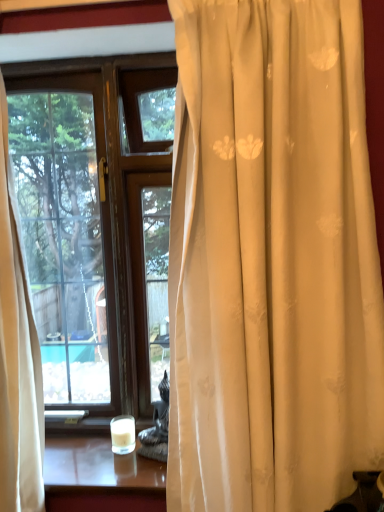
Question: Considering the relative positions of black textured statue at lower center and white glass candle at lower center in the image provided, is black textured statue at lower center to the left or to the right of white glass candle at lower center?

Choices:
 (A) left
 (B) right

Answer: (B)

Question: Considering the positions of black textured statue at lower center and white glass candle at lower center in the image, is black textured statue at lower center wider or thinner than white glass candle at lower center?

Choices:
 (A) thin
 (B) wide

Answer: (B)

Question: Is point (162, 443) closer or farther from the camera than point (127, 445)?

Choices:
 (A) closer
 (B) farther

Answer: (B)

Question: Looking at the image, does white glass candle at lower center seem bigger or smaller compared to black textured statue at lower center?

Choices:
 (A) big
 (B) small

Answer: (B)

Question: Does point (114, 452) appear closer or farther from the camera than point (163, 430)?

Choices:
 (A) closer
 (B) farther

Answer: (A)

Question: Is white glass candle at lower center in front of or behind black textured statue at lower center in the image?

Choices:
 (A) behind
 (B) front

Answer: (A)

Question: From the image's perspective, is white glass candle at lower center located above or below black textured statue at lower center?

Choices:
 (A) above
 (B) below

Answer: (B)